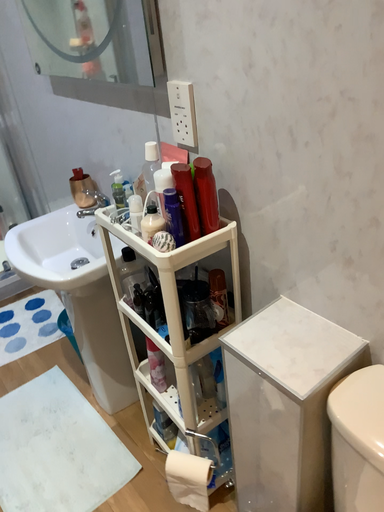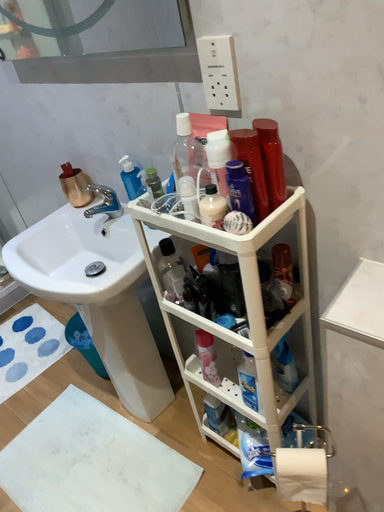
Question: How did the camera likely rotate when shooting the video?

Choices:
 (A) rotated right
 (B) rotated left

Answer: (A)